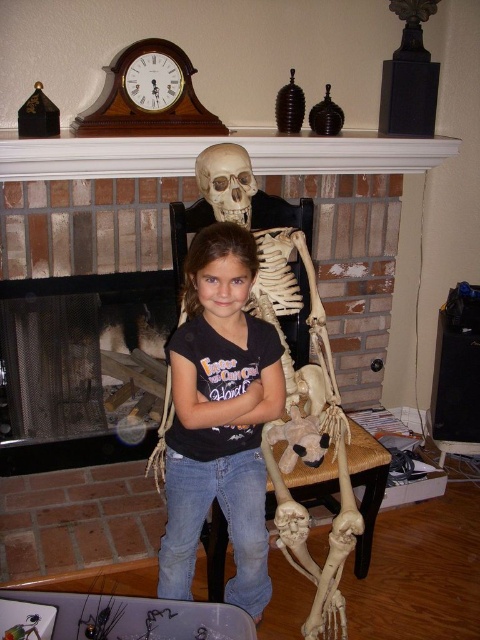
You are a painter who wants to hang a picture frame exactly between the brick fireplace at center and the matte plastic skull at upper center. Based on their positions, where should you place the frame?

The brick fireplace at center is below the matte plastic skull at upper center, so to hang the picture frame exactly between them, position it midway between the two objects along the vertical axis.

Consider the image. You are a guest at a Halloween party and notice the matte black shirt at center and the matte plastic skull at upper center. Which object is located higher up in the image?

The matte plastic skull at upper center is higher up because it is positioned above the matte black shirt at center.

In the scene shown: Where is the brick fireplace at center located in the image?

Result: The brick fireplace at center is located at point (192, 172).